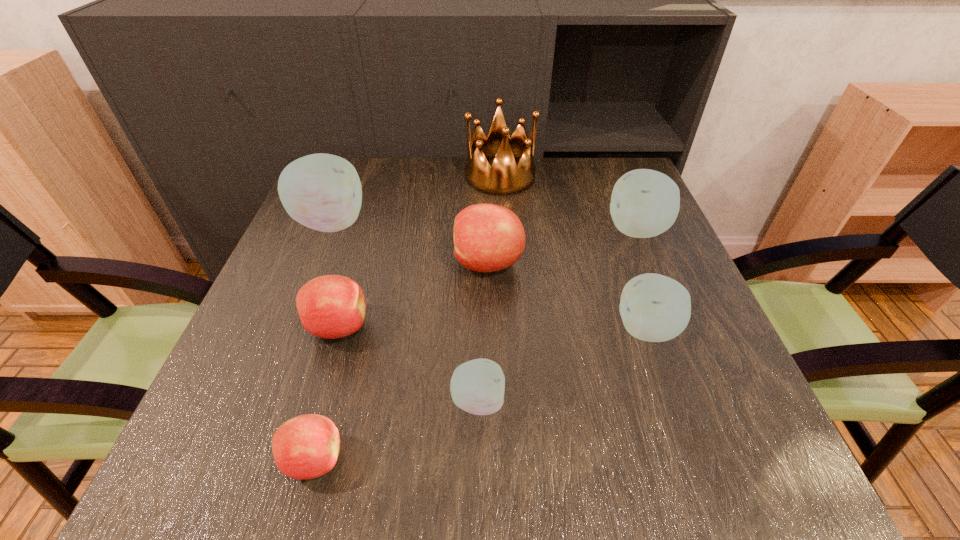
Identify the location of crown that is at the far edge. The width and height of the screenshot is (960, 540). (504, 177).

What are the coordinates of `apple that is positioned at the far edge` in the screenshot? It's located at (323, 192).

This screenshot has width=960, height=540. I want to click on object that is at the near edge, so click(305, 447).

Image resolution: width=960 pixels, height=540 pixels. Identify the location of object located in the far left corner section of the desktop. (323, 192).

In order to click on object present at the near left corner in this screenshot , I will do `click(305, 447)`.

You are a GUI agent. You are given a task and a screenshot of the screen. Output one action in this format:
    pyautogui.click(x=<x>, y=<y>)
    Task: Click on the free spot at the far edge of the desktop
    This screenshot has width=960, height=540.
    Given the screenshot: What is the action you would take?
    pyautogui.click(x=454, y=175)

Image resolution: width=960 pixels, height=540 pixels. In the image, there is a desktop. What are the coordinates of `free space at the near edge` in the screenshot? It's located at (644, 435).

This screenshot has width=960, height=540. I want to click on vacant space at the left edge of the desktop, so click(285, 386).

In the image, there is a desktop. At what (x,y) coordinates should I click in order to perform the action: click on vacant space at the right edge. Please return your answer as a coordinate pair (x, y). The image size is (960, 540). Looking at the image, I should click on (655, 261).

In the image, there is a desktop. Where is `blank space at the near left corner`? blank space at the near left corner is located at coordinates (264, 484).